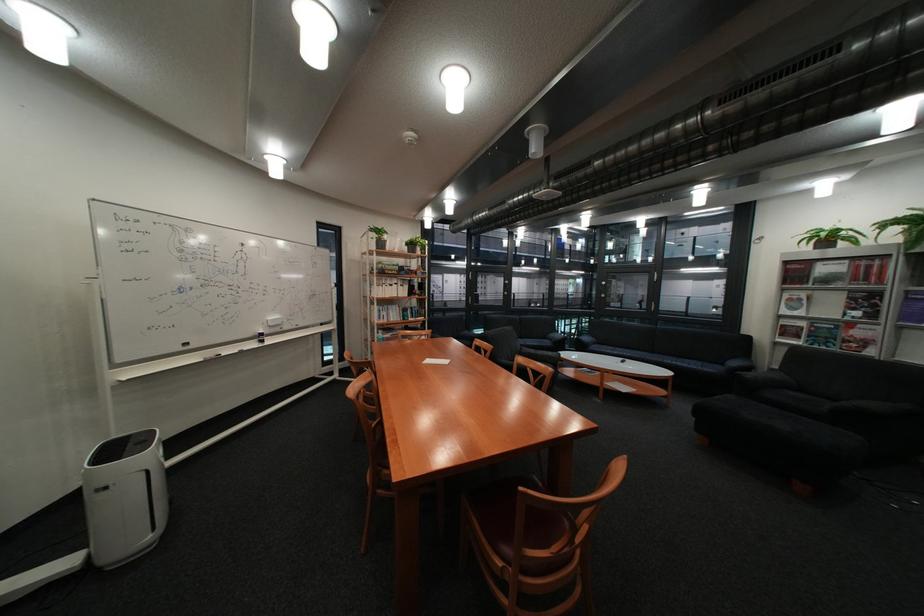
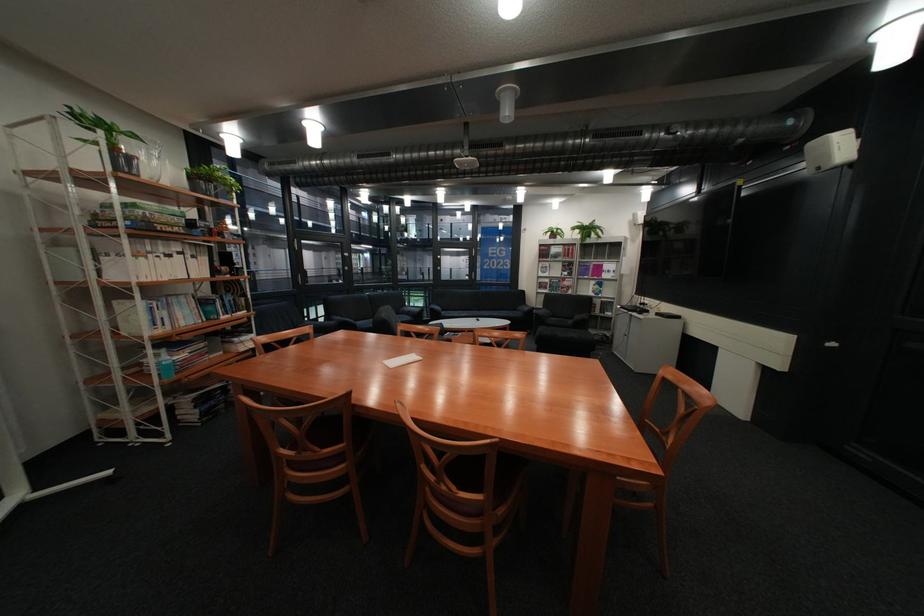
Locate, in the second image, the point that corresponds to point 391,331 in the first image.

(165, 351)